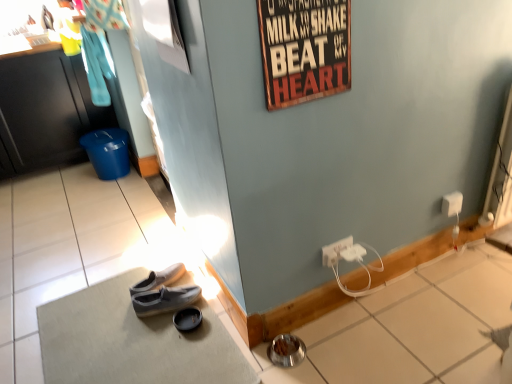
At what (x,y) coordinates should I click in order to perform the action: click on vacant space situated above gray fabric doormat at lower left (from a real-world perspective). Please return your answer as a coordinate pair (x, y). Looking at the image, I should click on (131, 331).